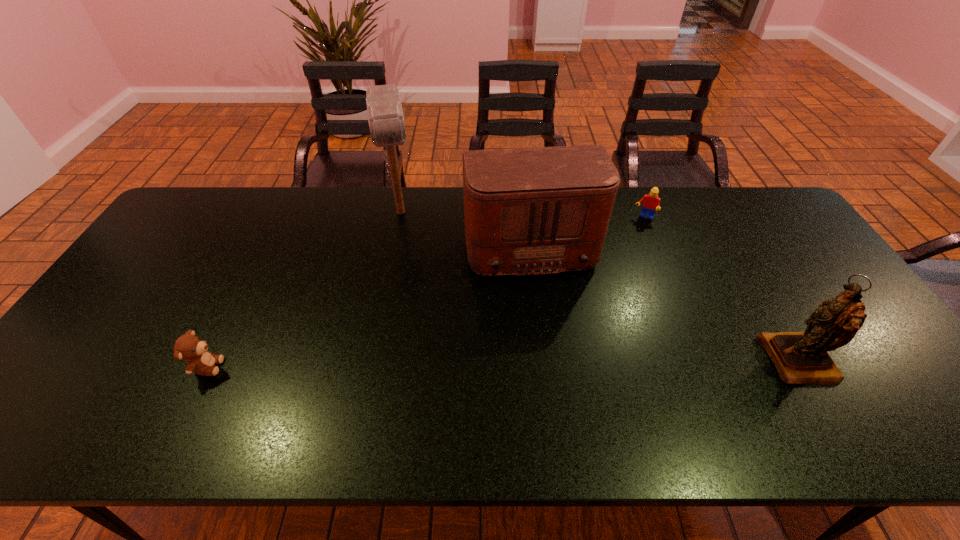
This screenshot has height=540, width=960. I want to click on free space on the desktop that is between the teddy bear and the rightmost object and is positioned on the front panel of the radio receiver, so click(x=558, y=363).

Where is `vacant space on the desktop that is between the leftmost object and the rightmost object and is positioned on the striking face of the mallet`? The height and width of the screenshot is (540, 960). vacant space on the desktop that is between the leftmost object and the rightmost object and is positioned on the striking face of the mallet is located at coordinates (421, 364).

Where is `free space on the desktop that is between the teddy bear and the figurine and is positioned on the front-facing side of the Lego`? Image resolution: width=960 pixels, height=540 pixels. free space on the desktop that is between the teddy bear and the figurine and is positioned on the front-facing side of the Lego is located at coordinates (591, 363).